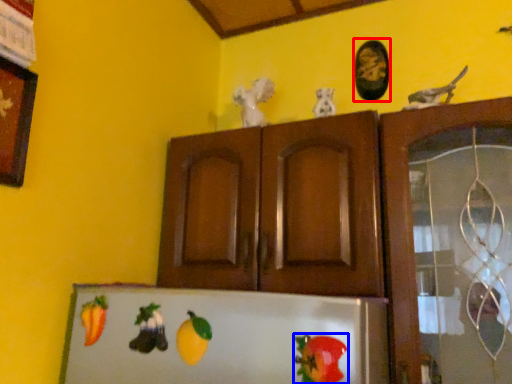
Question: Which object appears closest to the camera in this image, picture frame (highlighted by a red box) or vegetable (highlighted by a blue box)?

Choices:
 (A) picture frame
 (B) vegetable

Answer: (B)